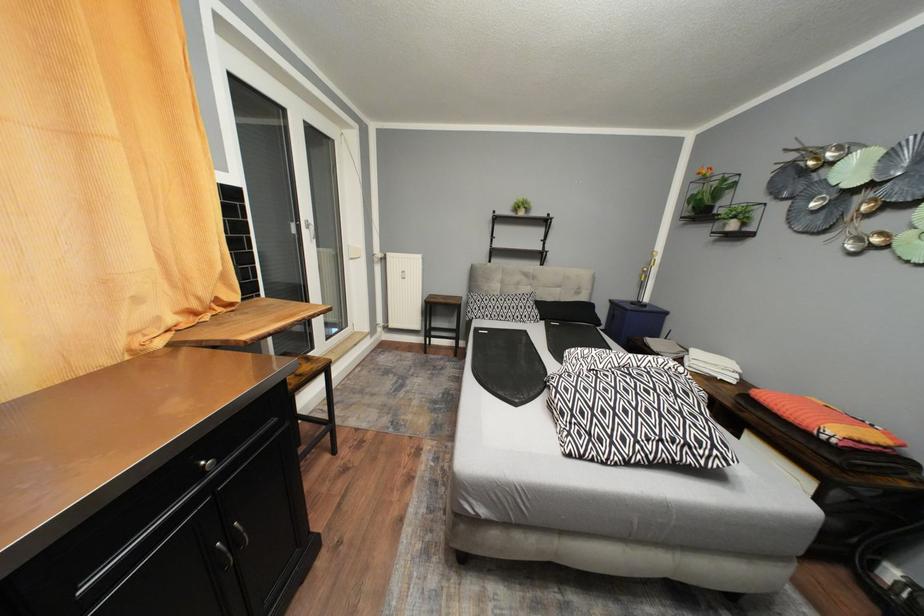
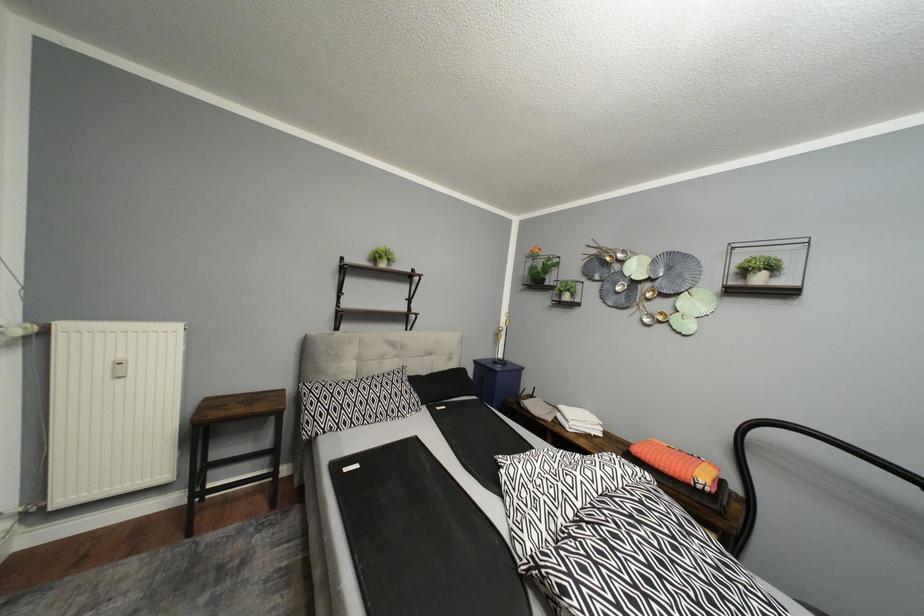
Question: The first image is from the beginning of the video and the second image is from the end. How did the camera likely rotate when shooting the video?

Choices:
 (A) Left
 (B) Right
 (C) Up
 (D) Down

Answer: (B)